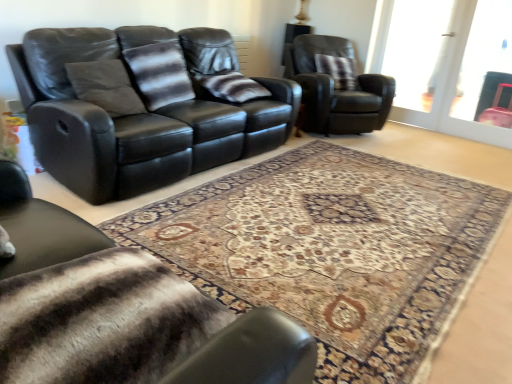
Question: Is plush brown pillow at upper right, the first pillow from the back, at the left side of transparent glass screen door at upper right?

Choices:
 (A) no
 (B) yes

Answer: (B)

Question: Does plush brown pillow at upper right, the first pillow from the back, have a smaller size compared to transparent glass screen door at upper right?

Choices:
 (A) yes
 (B) no

Answer: (A)

Question: From a real-world perspective, is plush brown pillow at upper right, the 3th pillow from the left, physically below transparent glass screen door at upper right?

Choices:
 (A) yes
 (B) no

Answer: (A)

Question: Is plush brown pillow at upper right, positioned as the 3th pillow in front-to-back order, thinner than transparent glass screen door at upper right?

Choices:
 (A) no
 (B) yes

Answer: (A)

Question: Considering the relative sizes of plush brown pillow at upper right, the 1th pillow viewed from the right, and transparent glass screen door at upper right in the image provided, is plush brown pillow at upper right, the 1th pillow viewed from the right, wider than transparent glass screen door at upper right?

Choices:
 (A) no
 (B) yes

Answer: (B)

Question: Is plush brown pillow at upper right, positioned as the 3th pillow in front-to-back order, facing away from transparent glass screen door at upper right?

Choices:
 (A) yes
 (B) no

Answer: (B)

Question: Can you confirm if patterned carpet at center is shorter than striped fabric pillow at center, acting as the 1th pillow starting from the left?

Choices:
 (A) no
 (B) yes

Answer: (B)

Question: Is patterned carpet at center surrounding striped fabric pillow at center, which is the third pillow in right-to-left order?

Choices:
 (A) no
 (B) yes

Answer: (A)

Question: Would you say patterned carpet at center is outside striped fabric pillow at center, which is the third pillow in right-to-left order?

Choices:
 (A) yes
 (B) no

Answer: (A)

Question: Considering the relative sizes of patterned carpet at center and striped fabric pillow at center, the 3th pillow viewed from the back, in the image provided, is patterned carpet at center smaller than striped fabric pillow at center, the 3th pillow viewed from the back,?

Choices:
 (A) yes
 (B) no

Answer: (B)

Question: From the image's perspective, is patterned carpet at center beneath striped fabric pillow at center, acting as the 1th pillow starting from the left?

Choices:
 (A) no
 (B) yes

Answer: (B)

Question: Is patterned carpet at center to the left of striped fabric pillow at center, the 3th pillow viewed from the back, from the viewer's perspective?

Choices:
 (A) no
 (B) yes

Answer: (A)

Question: Considering the relative positions of patterned carpet at center and striped fur blanket at lower left, acting as the 2th chair starting from the back, in the image provided, is patterned carpet at center to the right of striped fur blanket at lower left, acting as the 2th chair starting from the back, from the viewer's perspective?

Choices:
 (A) yes
 (B) no

Answer: (A)